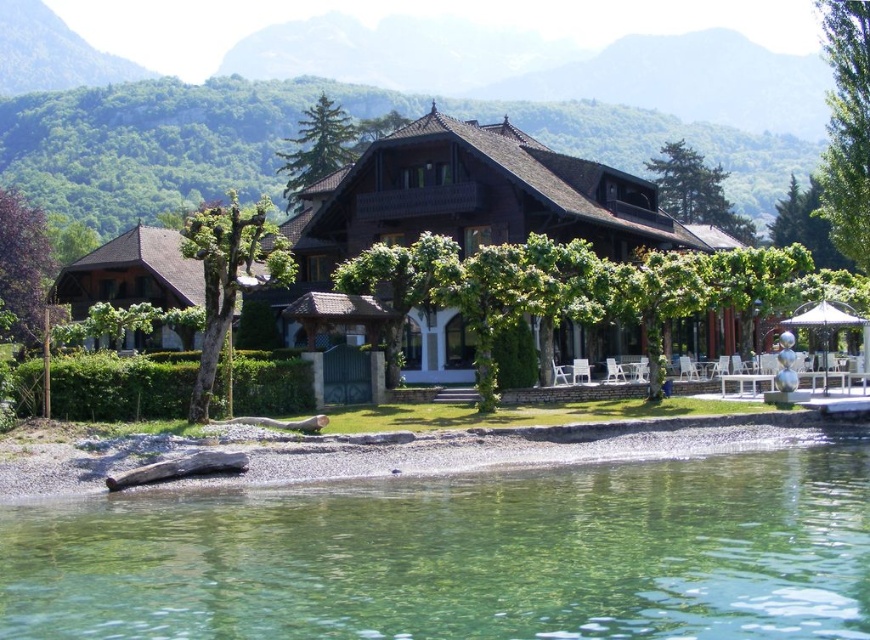
You are standing at the edge of the lake and want to place a floating dock. The coordinates for the dock must be within the water area. Can you confirm if the clear water at lower center at position 0.869, 0.533 is suitable for placing the dock?

The clear water at lower center is located at point (463, 556), so yes, it is suitable for placing the floating dock as it is within the water area.

You are planning to take a photo of the brown wooden gazebo at center from the clear water at lower center. Will the gazebo be visible in the reflection of the water?

The clear water at lower center is to the right of the brown wooden gazebo at center, so the gazebo may be visible in its reflection depending on the angle and positioning.

Looking at this image, you are planning to install a floating dock between the clear water at lower center and the brown wooden gazebo at center. The dock requires a minimum of 100 feet of space. Can the dock be installed in this location?

The distance between the clear water at lower center and the brown wooden gazebo at center is 115.38 feet, which exceeds the required 100 feet. Therefore, the floating dock can be installed in this location.